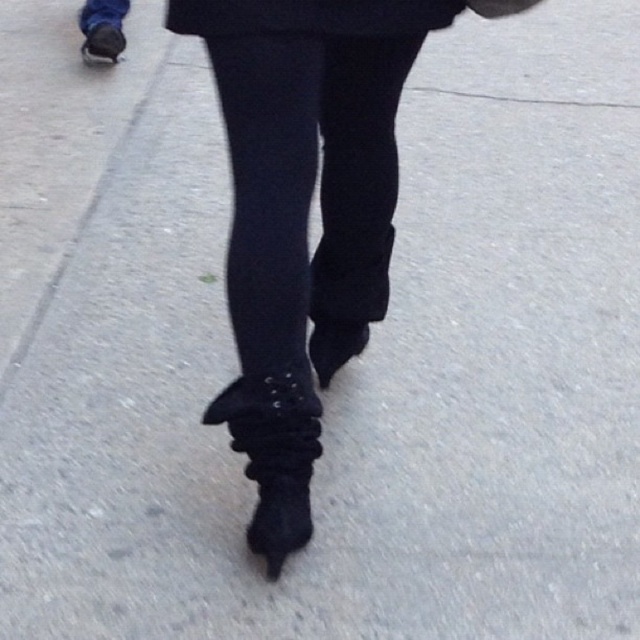
Question: Does black smooth tights at center appear under black matte coat at upper center?

Choices:
 (A) yes
 (B) no

Answer: (A)

Question: Which point appears farthest from the camera in this image?

Choices:
 (A) (216, 413)
 (B) (280, 8)

Answer: (A)

Question: Is black suede boot at lower center closer to camera compared to black matte coat at upper center?

Choices:
 (A) yes
 (B) no

Answer: (B)

Question: Does black smooth tights at center lie in front of black suede boot at lower center?

Choices:
 (A) yes
 (B) no

Answer: (A)

Question: Among these points, which one is farthest from the camera?

Choices:
 (A) (291, 216)
 (B) (220, 392)

Answer: (B)

Question: Which point appears farthest from the camera in this image?

Choices:
 (A) (296, 48)
 (B) (232, 35)
 (C) (300, 404)

Answer: (C)